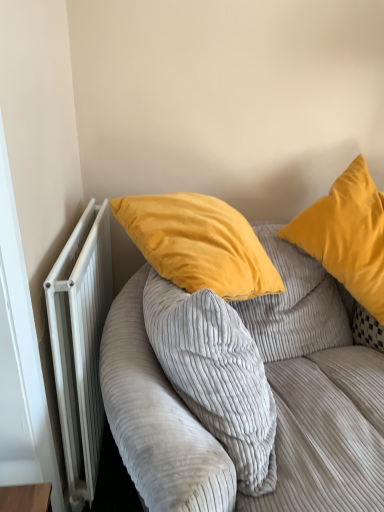
The image size is (384, 512). Find the location of `velvet yellow pillow at upper right`. velvet yellow pillow at upper right is located at coordinates (x=347, y=234).

Image resolution: width=384 pixels, height=512 pixels. In order to click on corduroy fabric couch at upper right in this screenshot , I will do `click(244, 390)`.

How many degrees apart are the facing directions of white metallic radiator at left and velvet yellow pillow at upper right?

103 degrees.

From the image's perspective, which one is positioned higher, white metallic radiator at left or velvet yellow pillow at upper right?

velvet yellow pillow at upper right is shown above in the image.

Is white metallic radiator at left placed right next to velvet yellow pillow at upper right?

There is a gap between white metallic radiator at left and velvet yellow pillow at upper right.

Is point (90, 260) closer to camera compared to point (330, 234)?

That is True.

Between velvet yellow pillow at upper right and white metallic radiator at left, which one is positioned behind?

velvet yellow pillow at upper right is more distant.

Looking at this image, would you say velvet yellow pillow at upper right is a long distance from white metallic radiator at left?

velvet yellow pillow at upper right is actually quite close to white metallic radiator at left.

Between velvet yellow pillow at upper right and white metallic radiator at left, which one appears on the right side from the viewer's perspective?

velvet yellow pillow at upper right.

Which of these two, velvet yellow pillow at upper right or white metallic radiator at left, is wider?

Wider between the two is velvet yellow pillow at upper right.

From a real-world perspective, between corduroy fabric couch at upper right and velvet yellow pillow at upper right, who is vertically higher?

velvet yellow pillow at upper right.

Choose the correct answer: Is corduroy fabric couch at upper right inside velvet yellow pillow at upper right or outside it?

corduroy fabric couch at upper right is not enclosed by velvet yellow pillow at upper right.

Considering the relative positions of corduroy fabric couch at upper right and velvet yellow pillow at upper right in the image provided, is corduroy fabric couch at upper right to the right of velvet yellow pillow at upper right from the viewer's perspective?

No.

Which object is further away from the camera taking this photo, white metallic radiator at left or corduroy fabric couch at upper right?

Positioned behind is white metallic radiator at left.

Is white metallic radiator at left directly adjacent to corduroy fabric couch at upper right?

Answer: white metallic radiator at left and corduroy fabric couch at upper right are not in contact.

From a real-world perspective, which object rests below the other?

white metallic radiator at left, from a real-world perspective.

Find the location of a particular element. Image resolution: width=384 pixels, height=512 pixels. radiator behind the corduroy fabric couch at upper right is located at coordinates (81, 344).

Is corduroy fabric couch at upper right looking in the opposite direction of white metallic radiator at left?

No, white metallic radiator at left is not at the back of corduroy fabric couch at upper right.

Measure the distance from corduroy fabric couch at upper right to white metallic radiator at left.

The distance of corduroy fabric couch at upper right from white metallic radiator at left is 14.05 inches.

From the image's perspective, does corduroy fabric couch at upper right appear lower than white metallic radiator at left?

Correct, corduroy fabric couch at upper right appears lower than white metallic radiator at left in the image.

Which object is more forward, corduroy fabric couch at upper right or white metallic radiator at left?

corduroy fabric couch at upper right is closer to the camera.

Between velvet yellow pillow at upper right and corduroy fabric couch at upper right, which one has smaller size?

With smaller size is velvet yellow pillow at upper right.

How far apart are velvet yellow pillow at upper right and corduroy fabric couch at upper right?

velvet yellow pillow at upper right and corduroy fabric couch at upper right are 14.18 inches apart from each other.

Does velvet yellow pillow at upper right touch corduroy fabric couch at upper right?

No, velvet yellow pillow at upper right is not making contact with corduroy fabric couch at upper right.

Is velvet yellow pillow at upper right closer to camera compared to corduroy fabric couch at upper right?

No, velvet yellow pillow at upper right is further to the viewer.

Where is `pillow located above the white metallic radiator at left (from a real-world perspective)`? The width and height of the screenshot is (384, 512). pillow located above the white metallic radiator at left (from a real-world perspective) is located at coordinates (347, 234).

At what (x,y) coordinates should I click in order to perform the action: click on pillow that is on the right side of white metallic radiator at left. Please return your answer as a coordinate pair (x, y). This screenshot has width=384, height=512. Looking at the image, I should click on (347, 234).

Based on their spatial positions, is velvet yellow pillow at upper right or corduroy fabric couch at upper right closer to white metallic radiator at left?

Based on the image, corduroy fabric couch at upper right appears to be nearer to white metallic radiator at left.

From the image, which object appears to be nearer to corduroy fabric couch at upper right, velvet yellow pillow at upper right or white metallic radiator at left?

The object closer to corduroy fabric couch at upper right is white metallic radiator at left.

From the picture: Estimate the real-world distances between objects in this image. Which object is closer to velvet yellow pillow at upper right, white metallic radiator at left or corduroy fabric couch at upper right?

corduroy fabric couch at upper right is positioned closer to the anchor velvet yellow pillow at upper right.

When comparing their distances from white metallic radiator at left, does corduroy fabric couch at upper right or velvet yellow pillow at upper right seem further?

velvet yellow pillow at upper right lies further to white metallic radiator at left than the other object.

When comparing their distances from velvet yellow pillow at upper right, does corduroy fabric couch at upper right or white metallic radiator at left seem closer?

corduroy fabric couch at upper right.

When comparing their distances from corduroy fabric couch at upper right, does white metallic radiator at left or velvet yellow pillow at upper right seem further?

velvet yellow pillow at upper right is further to corduroy fabric couch at upper right.

The image size is (384, 512). Find the location of `studio couch between white metallic radiator at left and velvet yellow pillow at upper right in the horizontal direction`. studio couch between white metallic radiator at left and velvet yellow pillow at upper right in the horizontal direction is located at coordinates (244, 390).